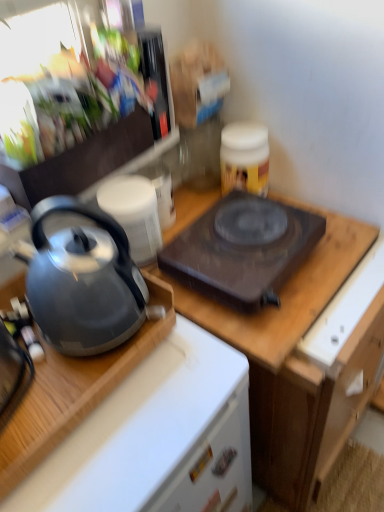
Where is `free space above black matte electric stove at center (from a real-world perspective)`? The width and height of the screenshot is (384, 512). free space above black matte electric stove at center (from a real-world perspective) is located at coordinates (249, 232).